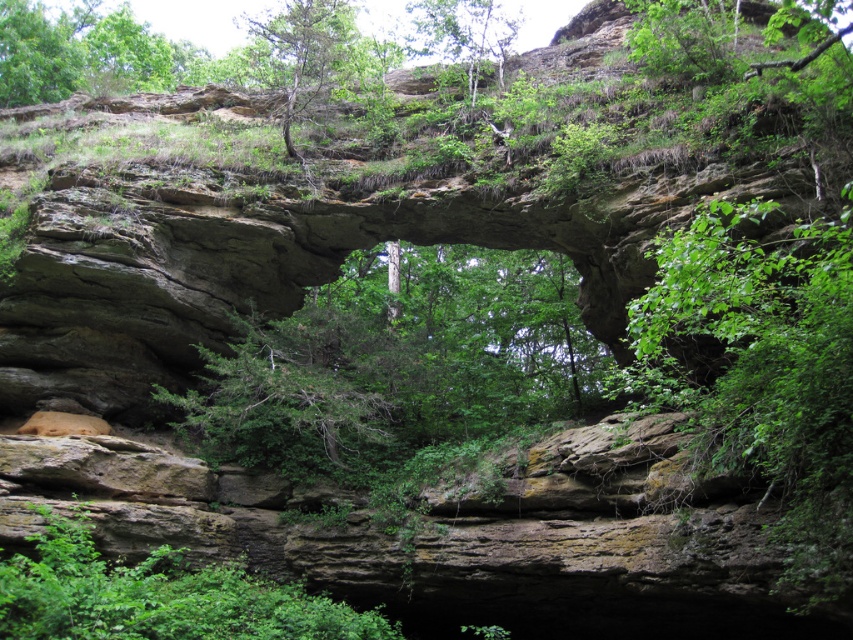
You are standing at the origin point of the coordinate system. You want to walk towards the green leafy tree at center. What coordinates should you head to?

You should head to the coordinates point at (399, 364) to reach the green leafy tree at center.

You are a hiker standing at the base of the rock formation. You notice two points marked on the rock surface. The first point is at coordinates point (570, 314), and the second is at point (480, 42). Which point is closer to you as you face the rock formation?

Point (570, 314) is in front of point (480, 42), so it is closer to you as you face the rock formation.

You are standing in front of the rock formation and want to take a photo of both the green leafy tree at center and the green leafy tree at upper center. Which tree will appear larger in your photo?

The green leafy tree at center will appear larger in the photo because it is closer to the viewer than the green leafy tree at upper center.